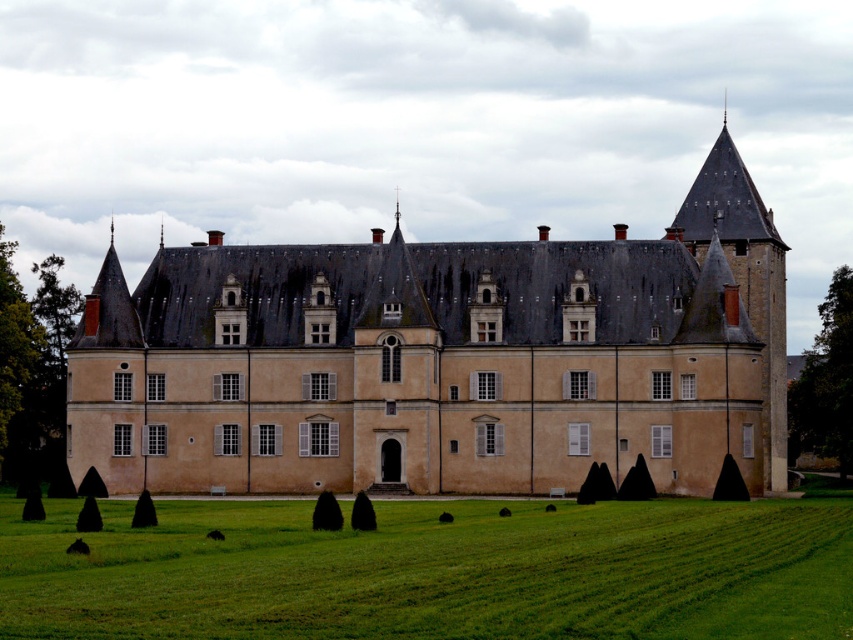
You are standing in front of the castle and notice two green leafy trees. Which tree is closer to you, the green leafy tree at left or the green leafy tree at right?

The green leafy tree at left is closer to you because it is positioned in front of the green leafy tree at right.

You are standing in front of the castle and want to take a photo that includes both the green leafy tree at left and the green leafy tree at right. Which tree should you position closer to the center of your camera frame to ensure both are equally visible in the photo?

You should position the green leafy tree at right closer to the center of your camera frame because it is shorter than the green leafy tree at left, allowing both to be equally visible in the photo.

Consider the image. You are standing on the green grass at lower center looking towards the beige stone castle at center. Which direction should you walk to reach the castle?

You should walk to your left because the beige stone castle at center is to the right of the green grass at lower center, so moving left would align you towards it.